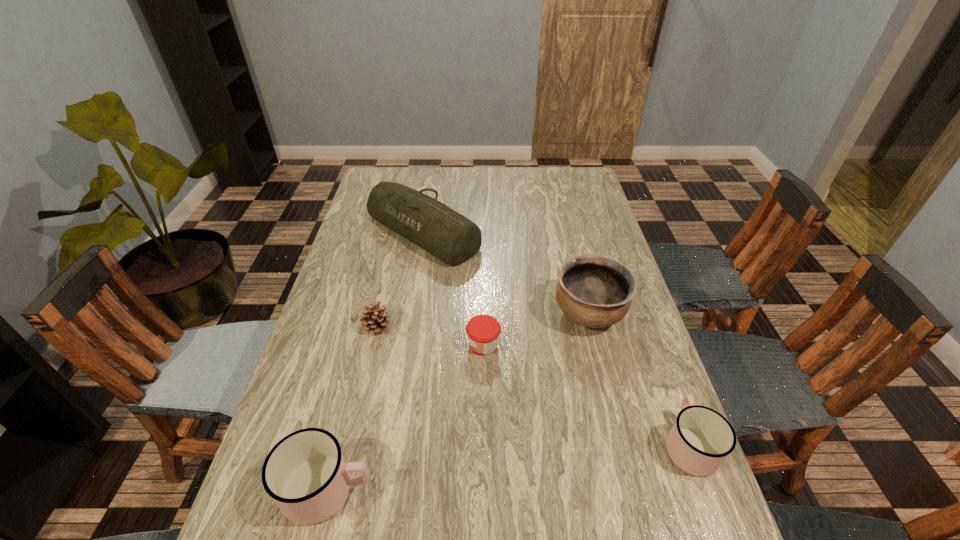
You are a GUI agent. You are given a task and a screenshot of the screen. Output one action in this format:
    pyautogui.click(x=<x>, y=<y>)
    Task: Click on the pinecone at the left edge
    The image size is (960, 540).
    Given the screenshot: What is the action you would take?
    pyautogui.click(x=373, y=318)

Locate an element on the screen. The width and height of the screenshot is (960, 540). mug located in the right edge section of the desktop is located at coordinates (700, 440).

Locate an element on the screen. pottery present at the right edge is located at coordinates pyautogui.click(x=595, y=291).

Where is `object that is positioned at the near left corner`? This screenshot has height=540, width=960. object that is positioned at the near left corner is located at coordinates (305, 473).

The height and width of the screenshot is (540, 960). What are the coordinates of `free location at the far edge` in the screenshot? It's located at (414, 170).

In the image, there is a desktop. In order to click on free space at the near edge in this screenshot , I will do `click(509, 511)`.

Locate an element on the screen. This screenshot has width=960, height=540. vacant space at the left edge is located at coordinates (362, 373).

At what (x,y) coordinates should I click in order to perform the action: click on vacant area at the right edge. Please return your answer as a coordinate pair (x, y). This screenshot has height=540, width=960. Looking at the image, I should click on (618, 472).

Identify the location of vacant position at the far left corner of the desktop. The image size is (960, 540). (396, 167).

Find the location of `empty space between the pottery and the farthest object`. empty space between the pottery and the farthest object is located at coordinates (506, 273).